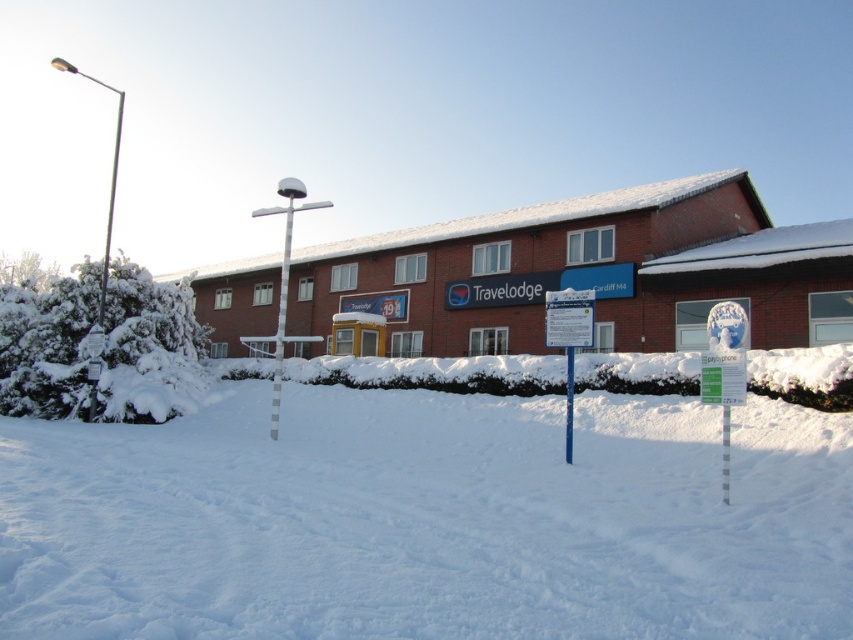
Between blue plastic sign at center and white plastic pole at center, which one is positioned higher?

white plastic pole at center is higher up.

Can you confirm if blue plastic sign at center is positioned below white plastic pole at center?

Yes, blue plastic sign at center is below white plastic pole at center.

Between point (573, 340) and point (572, 392), which one is positioned in front?

Point (572, 392)

Locate an element on the screen. The height and width of the screenshot is (640, 853). blue plastic sign at center is located at coordinates (569, 337).

The image size is (853, 640). What do you see at coordinates (432, 516) in the screenshot?
I see `white fluffy snow at center` at bounding box center [432, 516].

Which is in front, point (585, 628) or point (569, 426)?

Positioned in front is point (585, 628).

Which is behind, point (434, 378) or point (570, 385)?

Positioned behind is point (434, 378).

Identify the location of white fluffy snow at center. This screenshot has height=640, width=853. (432, 516).

Who is more distant from viewer, (715, 486) or (556, 333)?

The point (556, 333) is more distant.

Where is `white fluffy snow at center`? The height and width of the screenshot is (640, 853). white fluffy snow at center is located at coordinates (432, 516).

You are a GUI agent. You are given a task and a screenshot of the screen. Output one action in this format:
    pyautogui.click(x=<x>, y=<y>)
    Task: Click on the white fluffy snow at center
    The width and height of the screenshot is (853, 640).
    Given the screenshot: What is the action you would take?
    pyautogui.click(x=432, y=516)